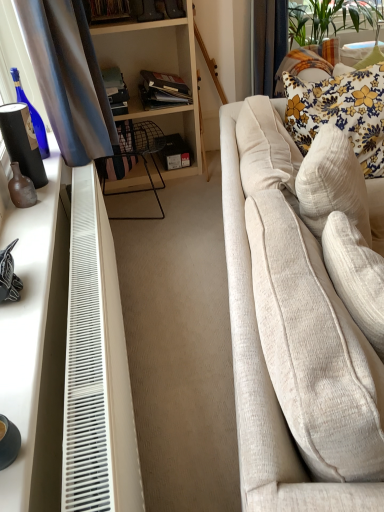
Question: Does brown matte vase at left appear on the left side of beige fabric couch at right?

Choices:
 (A) no
 (B) yes

Answer: (B)

Question: Considering the relative sizes of brown matte vase at left and beige fabric couch at right in the image provided, is brown matte vase at left bigger than beige fabric couch at right?

Choices:
 (A) no
 (B) yes

Answer: (A)

Question: Is brown matte vase at left not within beige fabric couch at right?

Choices:
 (A) no
 (B) yes

Answer: (B)

Question: Does brown matte vase at left lie in front of beige fabric couch at right?

Choices:
 (A) no
 (B) yes

Answer: (A)

Question: Does brown matte vase at left have a lesser width compared to beige fabric couch at right?

Choices:
 (A) yes
 (B) no

Answer: (A)

Question: Does point (8, 136) appear closer or farther from the camera than point (276, 66)?

Choices:
 (A) farther
 (B) closer

Answer: (B)

Question: Relative to floral fabric pillow at upper right, is matte black vase at left in front or behind?

Choices:
 (A) front
 (B) behind

Answer: (A)

Question: In terms of width, does matte black vase at left look wider or thinner when compared to floral fabric pillow at upper right?

Choices:
 (A) wide
 (B) thin

Answer: (B)

Question: Is matte black vase at left inside or outside of floral fabric pillow at upper right?

Choices:
 (A) inside
 (B) outside

Answer: (B)

Question: Looking at their shapes, would you say floral fabric pillow at upper right is wider or thinner than brown matte vase at left?

Choices:
 (A) thin
 (B) wide

Answer: (B)

Question: Is floral fabric pillow at upper right in front of or behind brown matte vase at left in the image?

Choices:
 (A) behind
 (B) front

Answer: (A)

Question: Looking at the image, does floral fabric pillow at upper right seem bigger or smaller compared to brown matte vase at left?

Choices:
 (A) small
 (B) big

Answer: (B)

Question: Considering the relative positions of floral fabric pillow at upper right and brown matte vase at left in the image provided, is floral fabric pillow at upper right to the left or to the right of brown matte vase at left?

Choices:
 (A) right
 (B) left

Answer: (A)

Question: Is point (66, 307) positioned closer to the camera than point (269, 86)?

Choices:
 (A) farther
 (B) closer

Answer: (B)

Question: From a real-world perspective, is white matte desk at left above or below floral fabric pillow at upper right?

Choices:
 (A) above
 (B) below

Answer: (A)